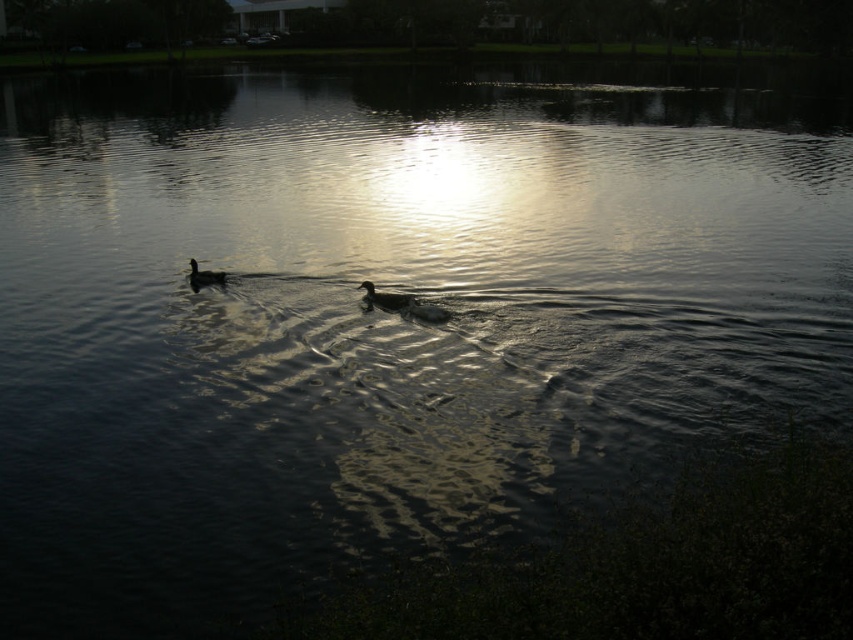
You are observing two ducks swimming in the water. The first duck has dark brown feathers at center and the second has dark brown feathers at left. From your perspective, which duck is closer to you?

The dark brown feathers at center is in front of dark brown feathers at left, so the duck with dark brown feathers at center is closer to you.

You are a wildlife photographer trying to capture both ducks in a single shot. Given that your camera has a maximum focus range of 3 meters, will you be able to include both dark brown feathers at center and dark brown feathers at left in the same photo?

The distance between dark brown feathers at center and dark brown feathers at left is 3.01 meters. Since the camera can only focus up to 3 meters, the two ducks are slightly beyond the focus range, so you won exceed the maximum focus range and won be able to capture both in sharp focus in a single shot.

You are observing two ducks in the water. The first duck has dark brown feathers at center and the second has dark brown feathers at left. Which duck is larger?

The dark brown feathers at center is bigger than dark brown feathers at left, so the first duck with dark brown feathers at center is larger.